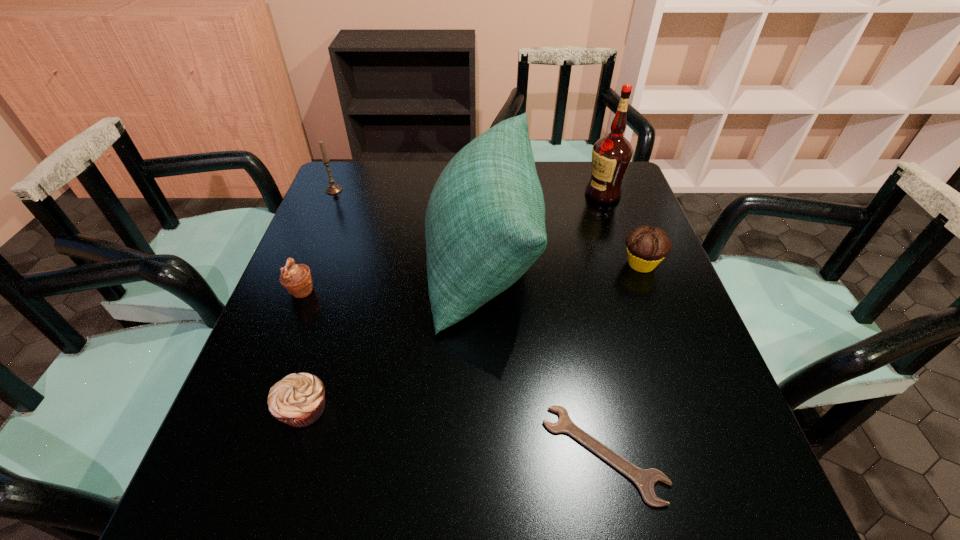
Where is `vacant space at the far edge of the desktop`? This screenshot has height=540, width=960. vacant space at the far edge of the desktop is located at coordinates (433, 168).

The width and height of the screenshot is (960, 540). In order to click on vacant space at the left edge of the desktop in this screenshot , I will do `click(329, 242)`.

You are a GUI agent. You are given a task and a screenshot of the screen. Output one action in this format:
    pyautogui.click(x=<x>, y=<y>)
    Task: Click on the vacant region at the right edge of the desktop
    
    Given the screenshot: What is the action you would take?
    point(610,276)

The image size is (960, 540). What are the coordinates of `free location at the far left corner of the desktop` in the screenshot? It's located at (383, 167).

In the image, there is a desktop. At what (x,y) coordinates should I click in order to perform the action: click on vacant space at the near left corner. Please return your answer as a coordinate pair (x, y). The image size is (960, 540). Looking at the image, I should click on (259, 495).

The image size is (960, 540). In order to click on blank space at the near right corner of the desktop in this screenshot , I will do `click(690, 519)`.

Where is `empty space that is in between the farthest muffin and the wrench`? empty space that is in between the farthest muffin and the wrench is located at coordinates (622, 359).

Where is `free space between the third tallest object and the shortest object`? free space between the third tallest object and the shortest object is located at coordinates (468, 322).

At what (x,y) coordinates should I click in order to perform the action: click on free space between the second farthest muffin and the candle. Please return your answer as a coordinate pair (x, y). The height and width of the screenshot is (540, 960). Looking at the image, I should click on (318, 240).

You are a GUI agent. You are given a task and a screenshot of the screen. Output one action in this format:
    pyautogui.click(x=<x>, y=<y>)
    Task: Click on the vacant space that is in between the rightmost muffin and the second tallest object
    The image size is (960, 540).
    Given the screenshot: What is the action you would take?
    pyautogui.click(x=563, y=261)